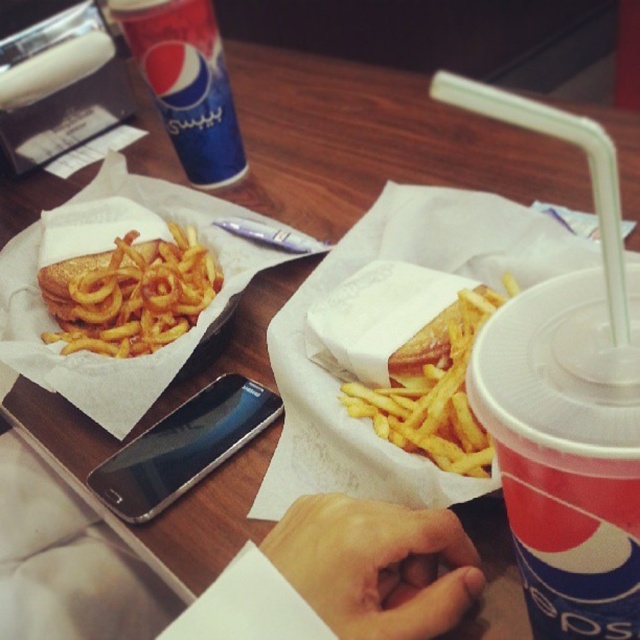
In the scene shown: You are holding a smartphone with a camera that has a 4.7 inch screen. You want to take a photo of the dining table setup so that the entire scene fits within the frame. Given that the point at coordinates point (576, 282) is 12.36 inches away from the camera, can you estimate whether the smartphone camera can capture the entire scene without moving closer or further away?

The point at coordinates point (576, 282) is 12.36 inches away from the camera. Since the smartphone has a 4.7 inch screen, and assuming the camera sensor can capture a field of view that accommodates this distance, it is possible that the entire scene can be captured. However, this depends on the camera lens specifications and angle of view. Without specific lens details, we can infer that at 12.36 inches, the 4.7 inch screen might sufficiently frame the scene if the camera is positioned to include all

You are a customer at a fast food restaurant and want to place your black glossy smartphone at center on the table without moving the golden crispy french fries at left. Is there enough space to the right of the fries to place the smartphone?

The golden crispy french fries at left is to the left of black glossy smartphone at center, so there is enough space to the right of the fries to place the smartphone without moving them.

You are a food delivery person who needs to pick up the golden crispy french fries at center from the table. The delivery robot has a reach of 45 centimeters. Can the robot reach the fries without moving closer?

The golden crispy french fries at center are 44.74 centimeters away from the viewer. Since the robot can reach up to 45 centimeters, it can just barely reach the fries without needing to move closer.